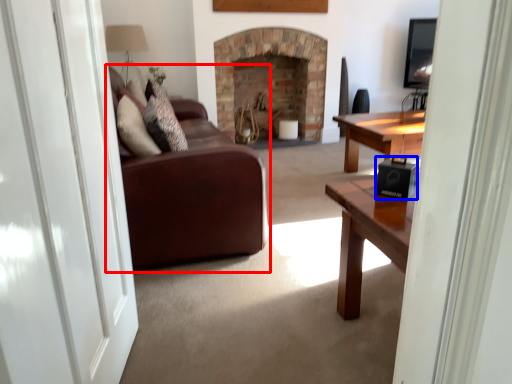
Question: Among these objects, which one is nearest to the camera, studio couch (highlighted by a red box) or speaker (highlighted by a blue box)?

Choices:
 (A) studio couch
 (B) speaker

Answer: (B)